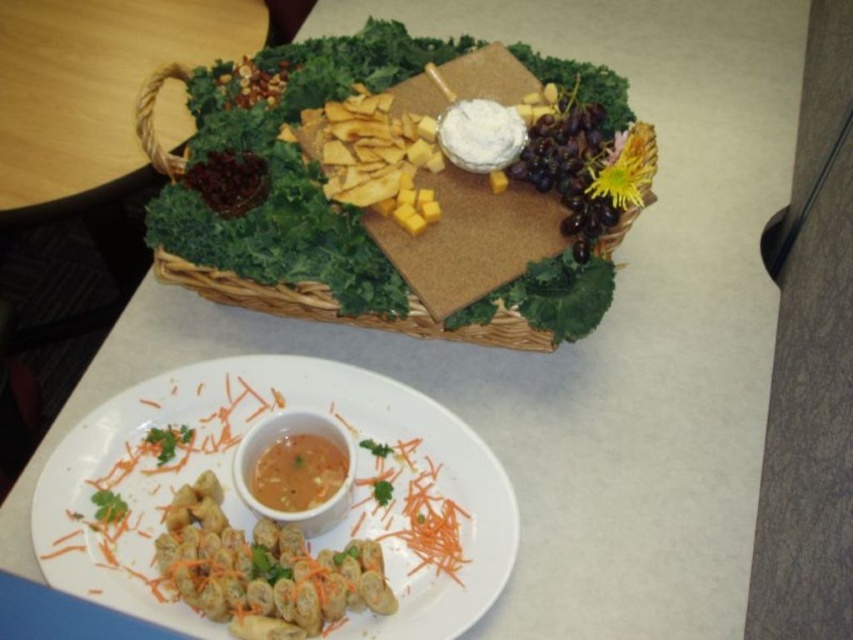
You are a food stylist arranging a photo shoot. You need to place a new decorative element between the white ceramic plate at lower center and the woven brown basket at upper center. Based on their positions, which side of the basket should you place it on to maintain symmetry?

The white ceramic plate at lower center is positioned on the left side of the woven brown basket at upper center. To maintain symmetry, the new decorative element should be placed on the right side of the woven brown basket at upper center.

You are a food stylist who needs to adjust the height of the white ceramic plate at lower center and the savory brown roll at center to make them equal. Which object should you raise or lower, and by how much?

The white ceramic plate at lower center is much taller than the savory brown roll at center. To make them equal, you should lower the white ceramic plate at lower center by the difference in their heights.

You are a chef setting up a food display and need to place a new decorative item on the table. The table has a white plate with spring rolls and a woven brown basket at upper center. Where should you place the new item to ensure it doesn not obstruct the main dish and remains visible?

The woven brown basket at upper center is located at point (338,307), so placing the new item away from this coordinate will keep it visible and not block the main dish.